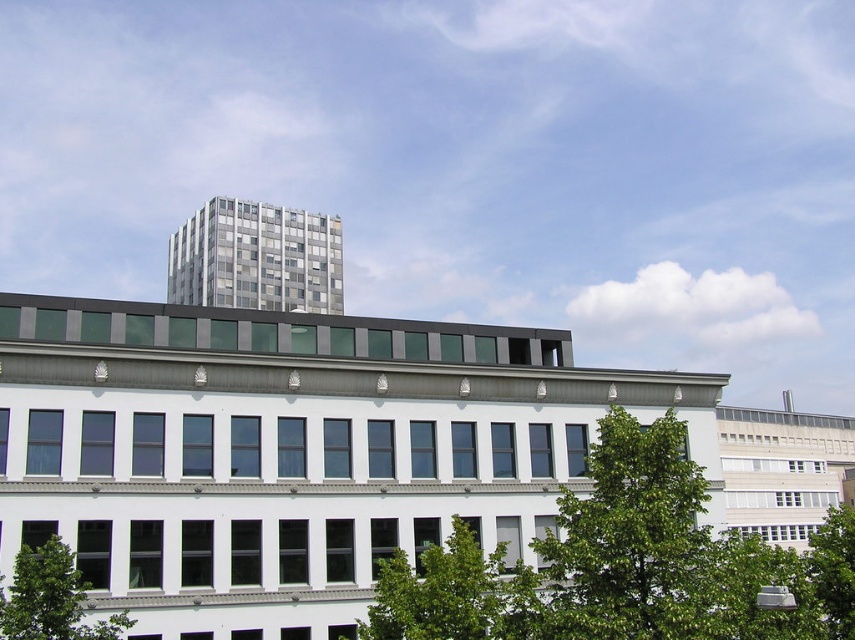
Question: Which point is closer to the camera?

Choices:
 (A) (821, 529)
 (B) (51, 579)
 (C) (693, 592)
 (D) (535, 616)

Answer: (C)

Question: Does green leafy tree at center come behind green leafy tree at lower right?

Choices:
 (A) yes
 (B) no

Answer: (B)

Question: Can you confirm if green leafy tree at lower left is bigger than green leafy tree at lower right?

Choices:
 (A) no
 (B) yes

Answer: (A)

Question: Which object is farther from the camera taking this photo?

Choices:
 (A) green leafy tree at lower left
 (B) green leafy tree at lower center

Answer: (A)

Question: Which of these objects is positioned closest to the green leafy tree at lower left?

Choices:
 (A) green leafy tree at lower right
 (B) green leafy tree at lower center
 (C) green leafy tree at center

Answer: (B)

Question: Where is green leafy tree at center located in relation to green leafy tree at lower right in the image?

Choices:
 (A) above
 (B) below

Answer: (A)